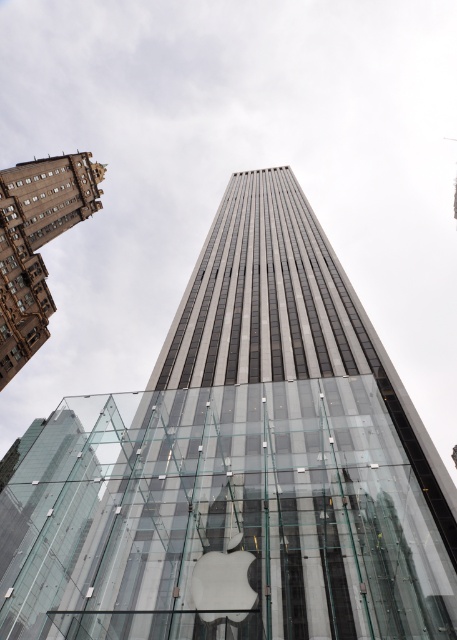
Can you confirm if glassy steel tower at center is positioned above brown stone building at upper left?

No.

Is point (347, 596) farther from viewer compared to point (67, 204)?

No, it is not.

Who is more distant from viewer, (x=233, y=429) or (x=1, y=308)?

Positioned behind is point (x=1, y=308).

The image size is (457, 640). In order to click on glassy steel tower at center in this screenshot , I will do `click(267, 458)`.